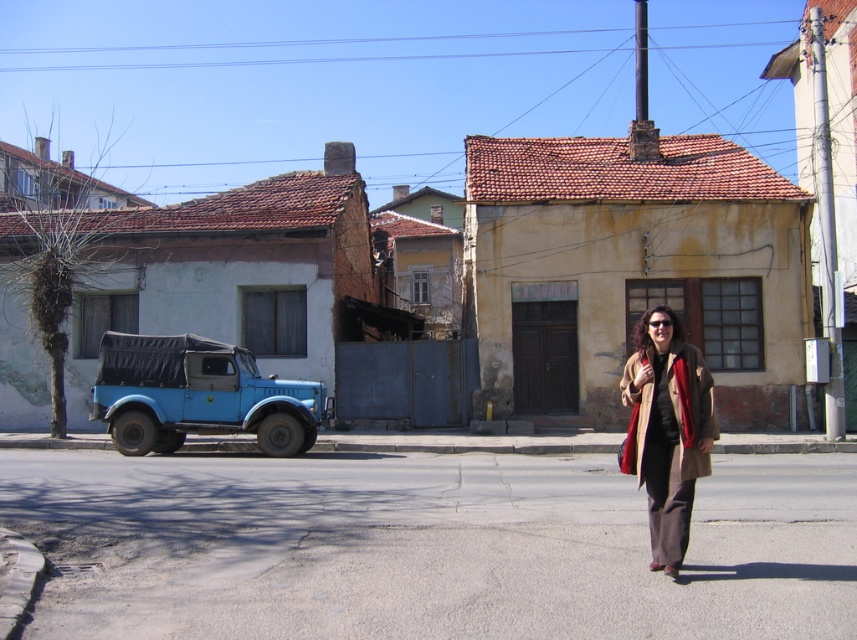
Question: Which point appears farthest from the camera in this image?

Choices:
 (A) (136, 410)
 (B) (704, 380)

Answer: (A)

Question: Which point is closer to the camera taking this photo?

Choices:
 (A) (150, 422)
 (B) (655, 333)

Answer: (B)

Question: Does blue matte jeep at left have a greater width compared to beige wool coat at center?

Choices:
 (A) no
 (B) yes

Answer: (B)

Question: Among these objects, which one is nearest to the camera?

Choices:
 (A) blue matte jeep at left
 (B) beige wool coat at center

Answer: (B)

Question: Does blue matte jeep at left come in front of beige wool coat at center?

Choices:
 (A) no
 (B) yes

Answer: (A)

Question: Is blue matte jeep at left to the left of beige wool coat at center from the viewer's perspective?

Choices:
 (A) yes
 (B) no

Answer: (A)